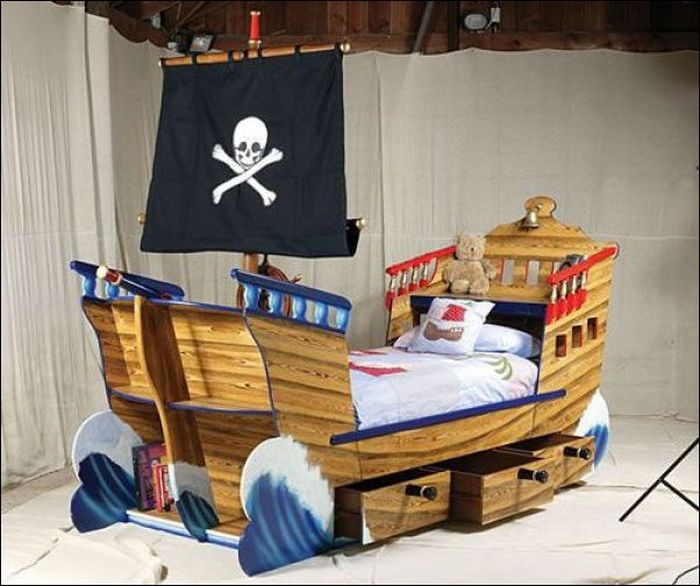
What are the coordinates of `teddy bear` in the screenshot? It's located at (475, 265).